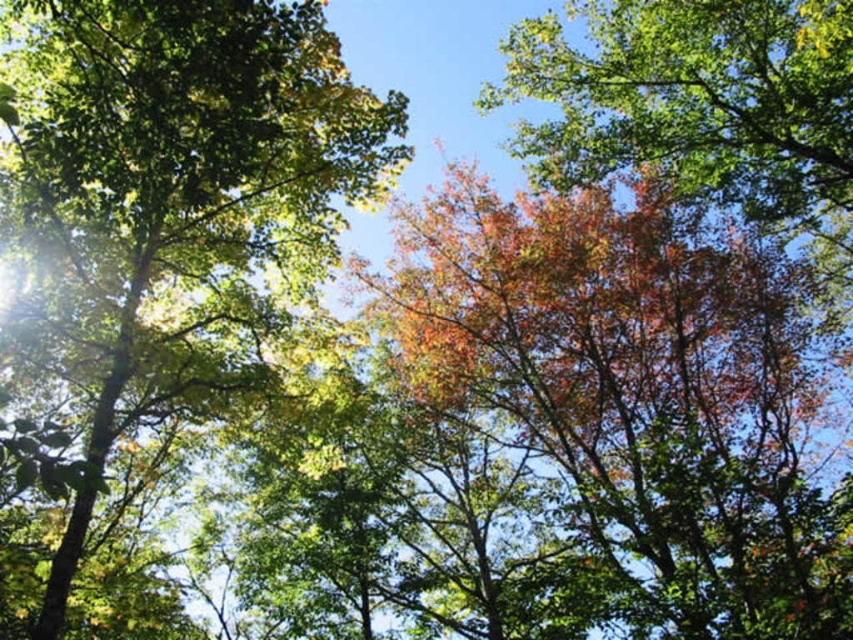
Question: Which of the following is the closest to the observer?

Choices:
 (A) multicolored foliage at upper right
 (B) green leafy tree at upper left
 (C) autumn leaves at center

Answer: (B)

Question: Observing the image, what is the correct spatial positioning of autumn leaves at center in reference to green leafy tree at upper left?

Choices:
 (A) right
 (B) left

Answer: (A)

Question: Which object is farther from the camera taking this photo?

Choices:
 (A) green leafy tree at upper left
 (B) multicolored foliage at upper right

Answer: (B)

Question: Is green leafy tree at upper left to the right of multicolored foliage at upper right from the viewer's perspective?

Choices:
 (A) no
 (B) yes

Answer: (A)

Question: Is autumn leaves at center thinner than multicolored foliage at upper right?

Choices:
 (A) yes
 (B) no

Answer: (A)

Question: Which point is closer to the camera taking this photo?

Choices:
 (A) (218, 74)
 (B) (607, 97)

Answer: (A)